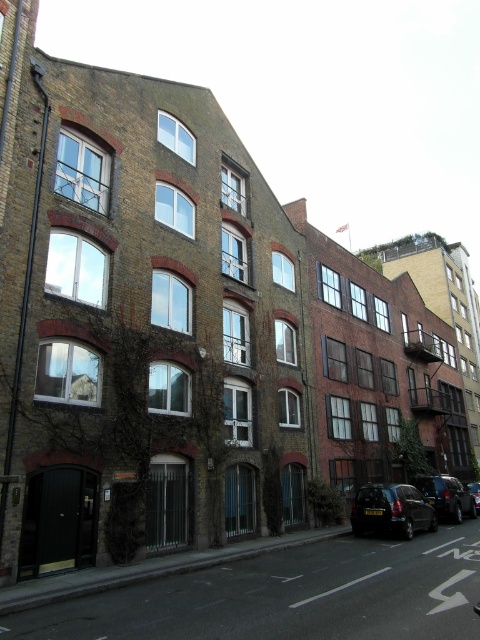
You are a delivery person standing at the camera position. You need to park your delivery van, which is 7 meters long, between the black matte car at lower right and the nearest building. Is there enough space?

The distance between the black matte car at lower right and the camera is 18.63 meters. Since the van is 7 meters long, there is sufficient space to park between them without encroaching on the building.

You are a pedestrian standing on the sidewalk in front of the buildings. You notice two cars parked at the lower right of the image. Which car is closer to the buildings, the black matte car at lower right or the shiny black car at lower right?

The black matte car at lower right is located above the shiny black car at lower right, meaning it is closer to the buildings.